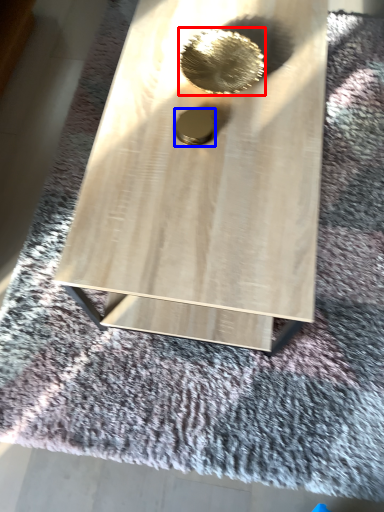
Question: Which of the following is the closest to the observer, hole (highlighted by a red box) or hole (highlighted by a blue box)?

Choices:
 (A) hole
 (B) hole

Answer: (B)